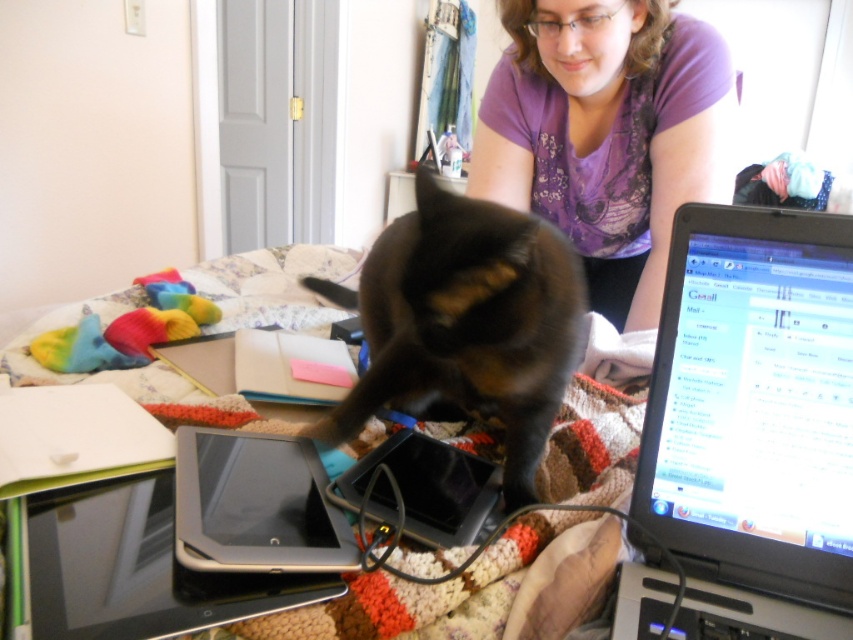
Who is taller, silver metallic tablet at lower left or black plastic tablet at center?

Standing taller between the two is black plastic tablet at center.

Is silver metallic tablet at lower left in front of black plastic tablet at center?

Yes, it is.

Is point (62, 550) positioned behind point (287, 461)?

No, (62, 550) is closer to viewer.

Locate an element on the screen. This screenshot has width=853, height=640. silver metallic tablet at lower left is located at coordinates (137, 568).

Consider the image. How far apart are silver metallic laptop at right and black plastic tablet at center?

The distance of silver metallic laptop at right from black plastic tablet at center is 9.84 inches.

Which of these two, silver metallic laptop at right or black plastic tablet at center, stands taller?

silver metallic laptop at right

At what (x,y) coordinates should I click in order to perform the action: click on silver metallic laptop at right. Please return your answer as a coordinate pair (x, y). Looking at the image, I should click on (753, 422).

Consider the image. Is purple printed shirt at upper center taller than silver metallic tablet at lower left?

Indeed, purple printed shirt at upper center has a greater height compared to silver metallic tablet at lower left.

Locate an element on the screen. The image size is (853, 640). purple printed shirt at upper center is located at coordinates (608, 132).

The image size is (853, 640). Find the location of `purple printed shirt at upper center`. purple printed shirt at upper center is located at coordinates (608, 132).